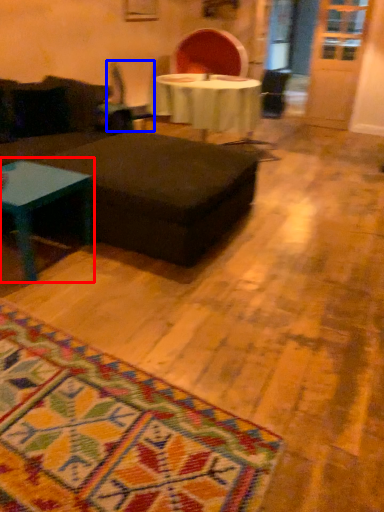
Question: Which object is closer to the camera taking this photo, coffee table (highlighted by a red box) or swivel chair (highlighted by a blue box)?

Choices:
 (A) coffee table
 (B) swivel chair

Answer: (A)